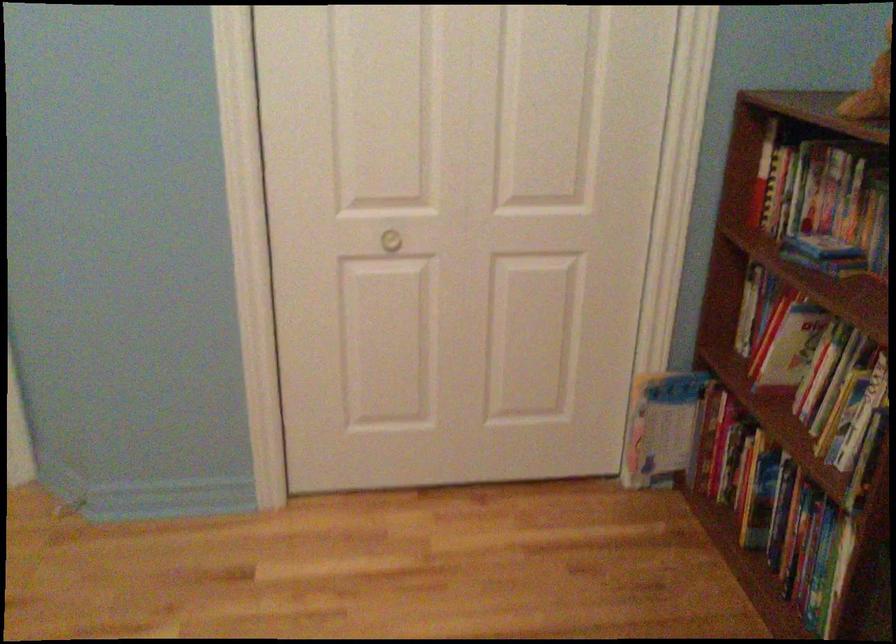
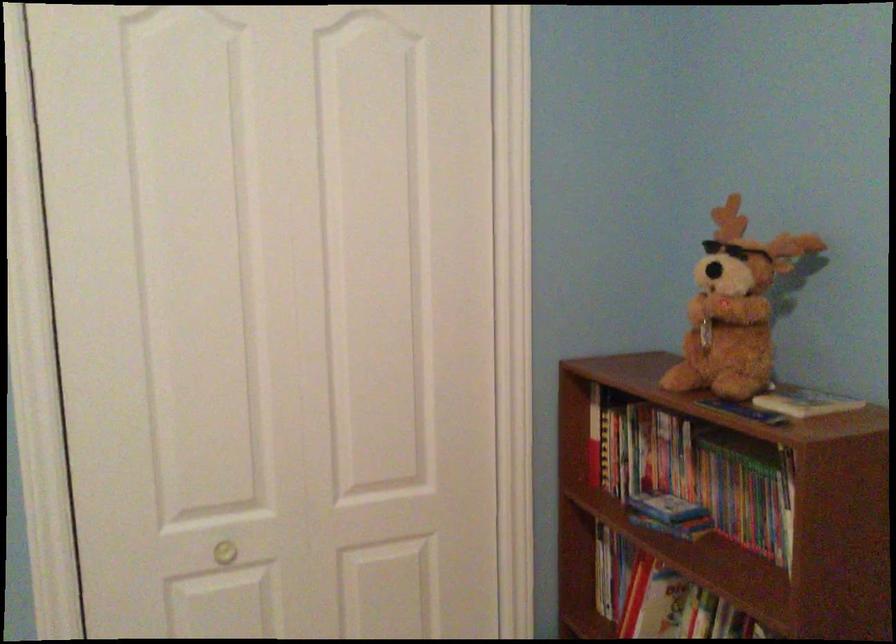
What movement of the cameraman would produce the second image?

The cameraman moved toward left, forward.